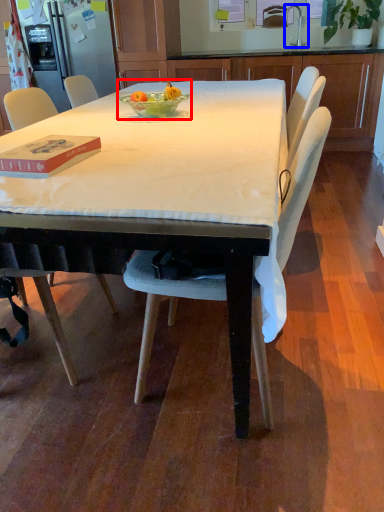
Question: Which object is closer to the camera taking this photo, fruit dish (highlighted by a red box) or faucet (highlighted by a blue box)?

Choices:
 (A) fruit dish
 (B) faucet

Answer: (A)